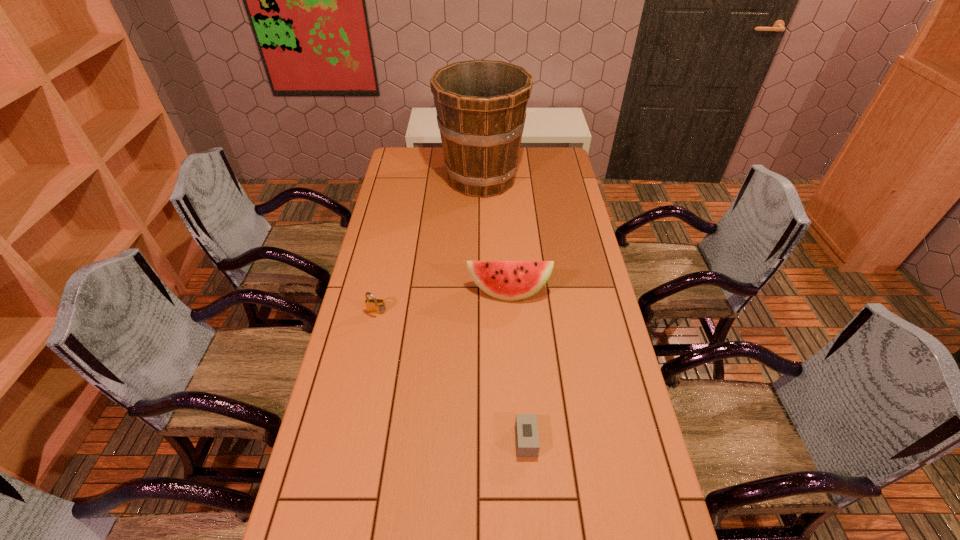
What are the coordinates of `free space located on the side with the combination dials of the padlock` in the screenshot? It's located at (360, 394).

The image size is (960, 540). I want to click on vacant space located on the front-facing side of the alarm clock, so click(478, 440).

Identify the location of vacant space situated 0.300m on the front-facing side of the alarm clock. (402, 440).

Find the location of a particular element. free space located 0.370m on the front-facing side of the alarm clock is located at coordinates (376, 440).

At what (x,y) coordinates should I click in order to perform the action: click on object present at the far edge. Please return your answer as a coordinate pair (x, y). The height and width of the screenshot is (540, 960). Looking at the image, I should click on (481, 105).

Locate an element on the screen. Image resolution: width=960 pixels, height=540 pixels. object that is at the left edge is located at coordinates (375, 306).

In the image, there is a desktop. Where is `free space at the far edge`? This screenshot has height=540, width=960. free space at the far edge is located at coordinates (524, 173).

Where is `free space at the left edge of the desktop`? This screenshot has height=540, width=960. free space at the left edge of the desktop is located at coordinates (406, 193).

What are the coordinates of `vacant area at the right edge` in the screenshot? It's located at (589, 352).

In the image, there is a desktop. Identify the location of vacant space at the far left corner. The image size is (960, 540). (396, 163).